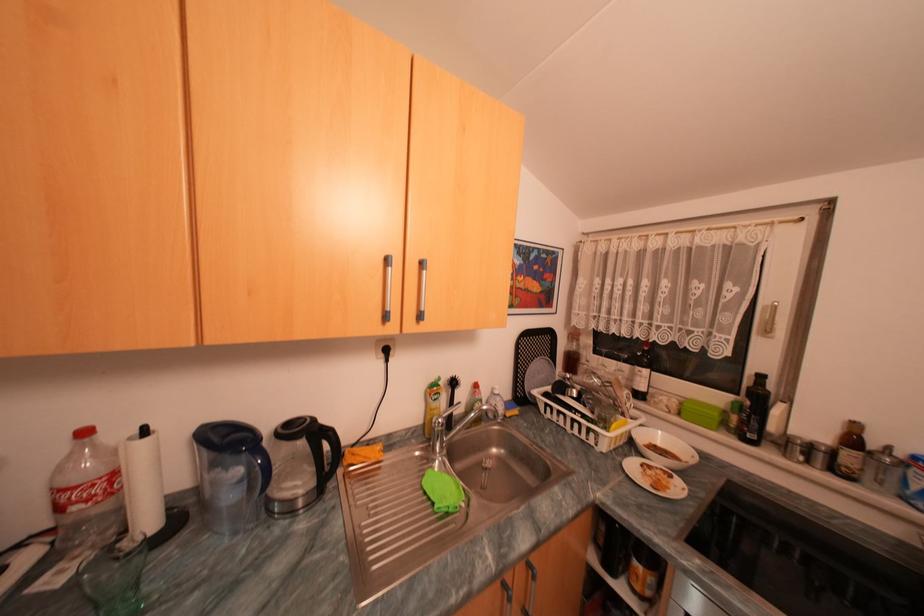
Find the location of a particular element. Image resolution: width=924 pixels, height=616 pixels. plastic soda bottle is located at coordinates (87, 492).